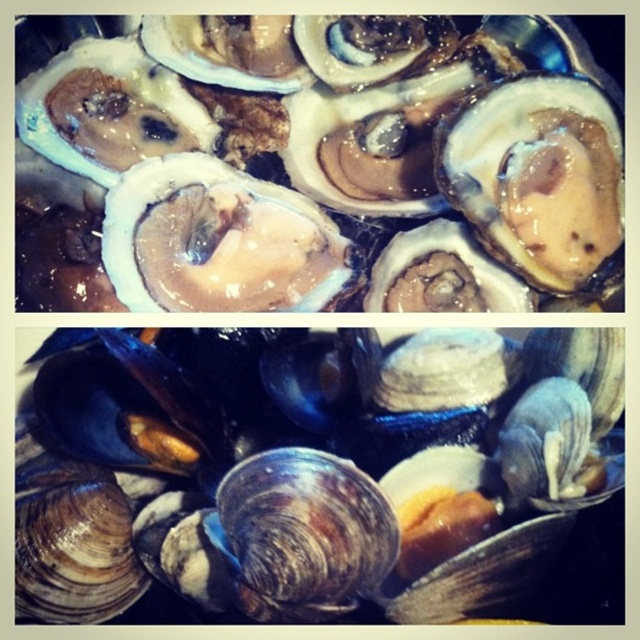
Question: Where is shiny white oyster at center located in relation to shiny brown shellfish at center in the image?

Choices:
 (A) right
 (B) left

Answer: (B)

Question: Which point is farther to the camera?

Choices:
 (A) shiny white oyster at center
 (B) shiny brown shellfish at center

Answer: (A)

Question: Can you confirm if shiny white oyster at center is bigger than shiny brown shellfish at center?

Choices:
 (A) yes
 (B) no

Answer: (A)

Question: Does shiny white oyster at center appear over shiny brown shellfish at center?

Choices:
 (A) yes
 (B) no

Answer: (A)